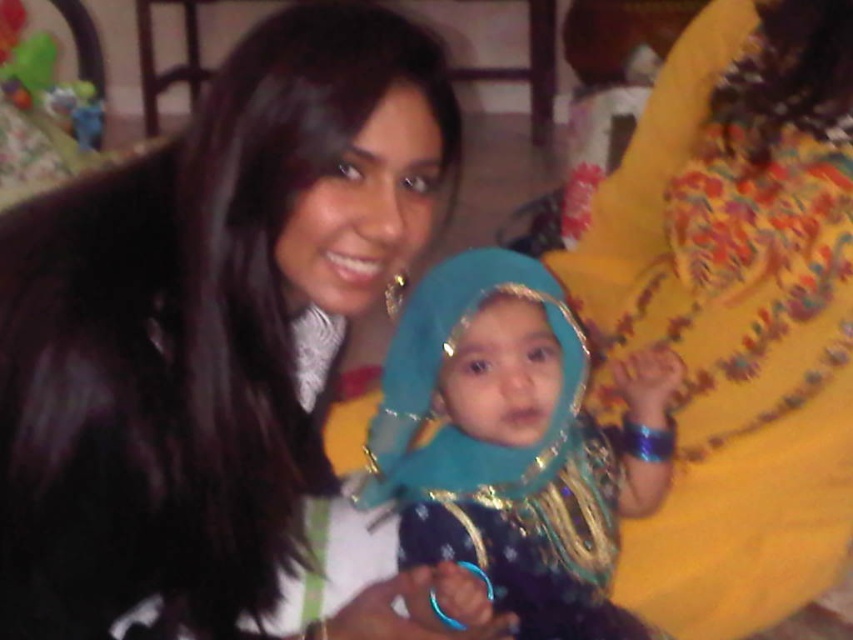
Question: Does black fur coat at center have a greater width compared to shiny blue fabric at center?

Choices:
 (A) no
 (B) yes

Answer: (B)

Question: Among these objects, which one is farthest from the camera?

Choices:
 (A) black fur coat at center
 (B) yellow embroidered dress at right
 (C) shiny blue fabric at center

Answer: (B)

Question: Considering the relative positions of black fur coat at center and yellow embroidered dress at right in the image provided, where is black fur coat at center located with respect to yellow embroidered dress at right?

Choices:
 (A) above
 (B) below

Answer: (B)

Question: Based on their relative distances, which object is farther from the yellow embroidered dress at right?

Choices:
 (A) black fur coat at center
 (B) shiny blue fabric at center

Answer: (A)

Question: Which object appears closest to the camera in this image?

Choices:
 (A) yellow embroidered dress at right
 (B) shiny blue fabric at center
 (C) black fur coat at center

Answer: (C)

Question: From the image, what is the correct spatial relationship of yellow embroidered dress at right in relation to shiny blue fabric at center?

Choices:
 (A) below
 (B) above

Answer: (B)